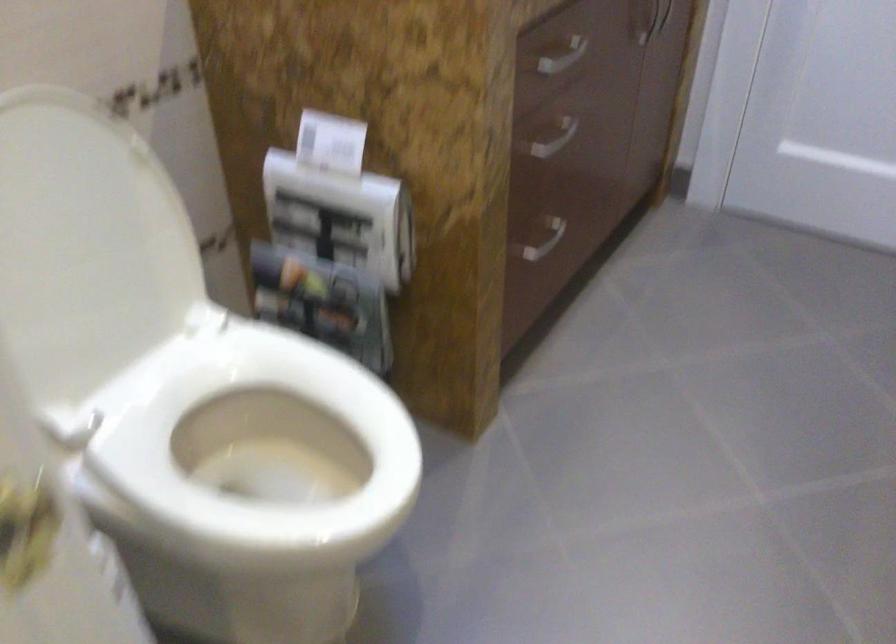
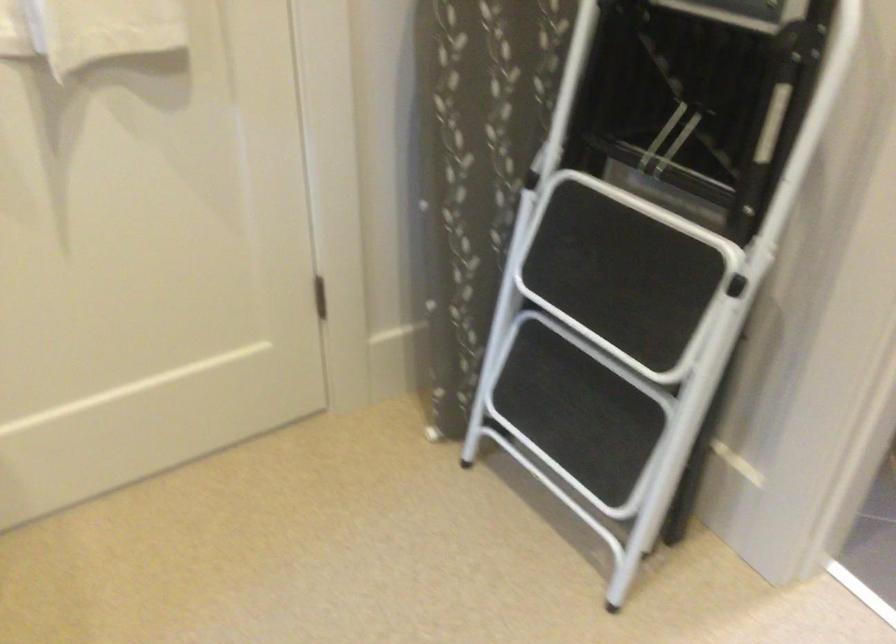
Question: I am providing you with two images of the same scene from different viewpoints. Please identify which objects are invisible in image2.

Choices:
 (A) black ladder step
 (B) white toilet lid
 (C) white towel
 (D) starfish decoration

Answer: (B)